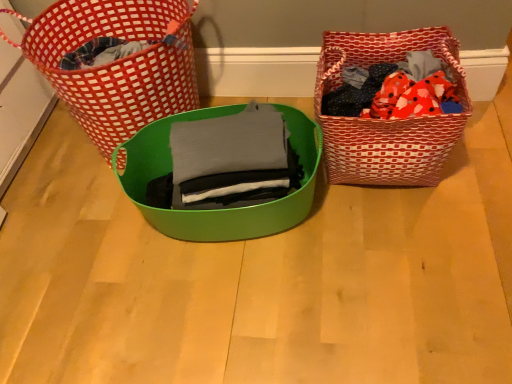
Identify the location of spots to the right of green plastic bowl at center. The width and height of the screenshot is (512, 384). (410, 229).